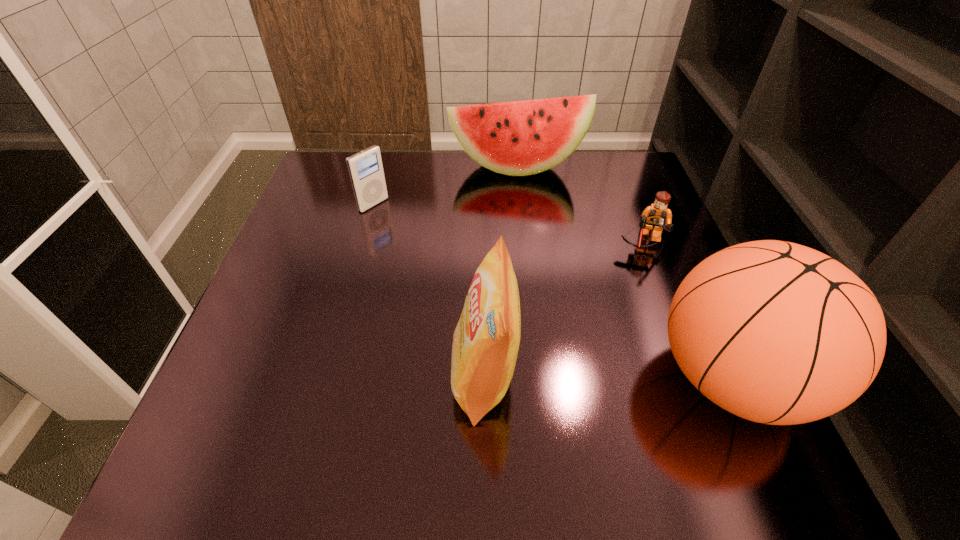
Locate an element on the screen. The height and width of the screenshot is (540, 960). vacant area located 0.270m on the front-facing side of the crisp (potato chip) is located at coordinates (300, 377).

Find the location of a particular element. Image resolution: width=960 pixels, height=540 pixels. free region located on the left of the basketball is located at coordinates (534, 376).

Identify the location of vacant space situated 0.060m holding a crossbow in the hands of the Lego. This screenshot has height=540, width=960. (642, 277).

Find the location of a particular element. Image resolution: width=960 pixels, height=540 pixels. vacant point located 0.280m holding a crossbow in the hands of the Lego is located at coordinates (639, 360).

You are a GUI agent. You are given a task and a screenshot of the screen. Output one action in this format:
    pyautogui.click(x=<x>, y=<y>)
    Task: Click on the vacant space situated 0.100m holding a crossbow in the hands of the Lego
    The image size is (960, 540).
    Given the screenshot: What is the action you would take?
    [641, 290]

You are a GUI agent. You are given a task and a screenshot of the screen. Output one action in this format:
    pyautogui.click(x=<x>, y=<y>)
    Task: Click on the free space located 0.340m on the outer rind of the third shortest object
    The width and height of the screenshot is (960, 540).
    Given the screenshot: What is the action you would take?
    pyautogui.click(x=547, y=268)

Locate an element on the screen. Image resolution: width=960 pixels, height=540 pixels. vacant space situated on the outer rind of the third shortest object is located at coordinates (530, 203).

The image size is (960, 540). What are the coordinates of `vacant space located on the outer rind of the third shortest object` in the screenshot? It's located at (540, 241).

Locate an element on the screen. vacant space positioned 0.340m on the front-facing side of the fourth tallest object is located at coordinates (482, 274).

You are a GUI agent. You are given a task and a screenshot of the screen. Output one action in this format:
    pyautogui.click(x=<x>, y=<y>)
    Task: Click on the free space located 0.170m on the front-facing side of the fourth tallest object
    The width and height of the screenshot is (960, 540).
    Given the screenshot: What is the action you would take?
    point(428,240)